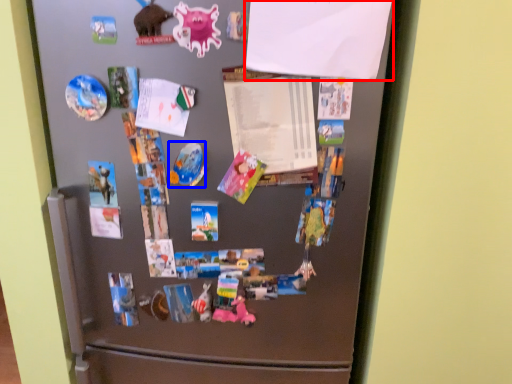
Question: Which object is further to the camera taking this photo, paper (highlighted by a red box) or art (highlighted by a blue box)?

Choices:
 (A) paper
 (B) art

Answer: (B)